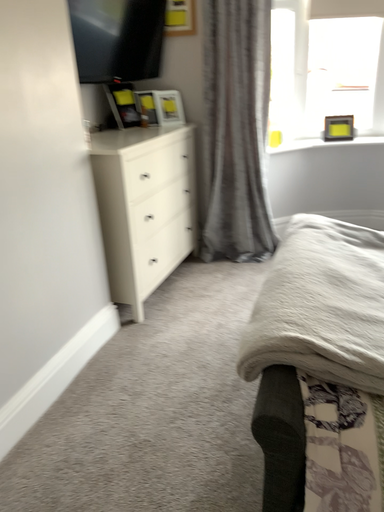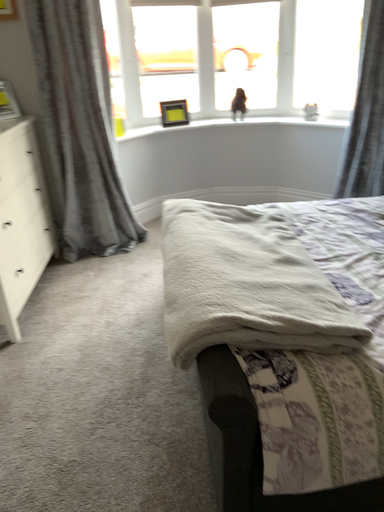
Question: Which way did the camera rotate in the video?

Choices:
 (A) rotated right
 (B) rotated left

Answer: (A)